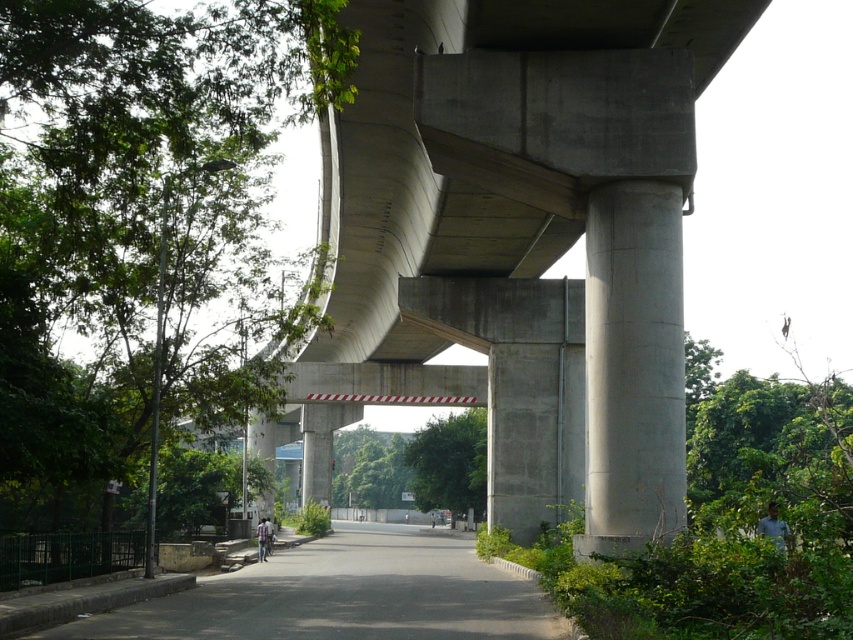
You are a delivery person who needs to drive a truck that is 3 meters tall through the area under the overpass. Based on the scene, can you safely pass under the overpass without hitting the black asphalt road at center or the gray concrete pillar at center?

The black asphalt road at center is much taller than the gray concrete pillar at center. Since the truck is 3 meters tall, it depends on the actual height clearance under the overpass. However, the description does not provide specific measurements, so it is unsafe to assume it can pass.

You are a construction worker planning to place a heavy equipment on the concrete at center and gray concrete pillar at center. Which object should you avoid placing the equipment on to prevent damage?

You should avoid placing the equipment on the gray concrete pillar at center because the concrete at center is positioned on its left side, and pillars are typically designed to support structural weight rather than bear additional heavy loads on their sides.